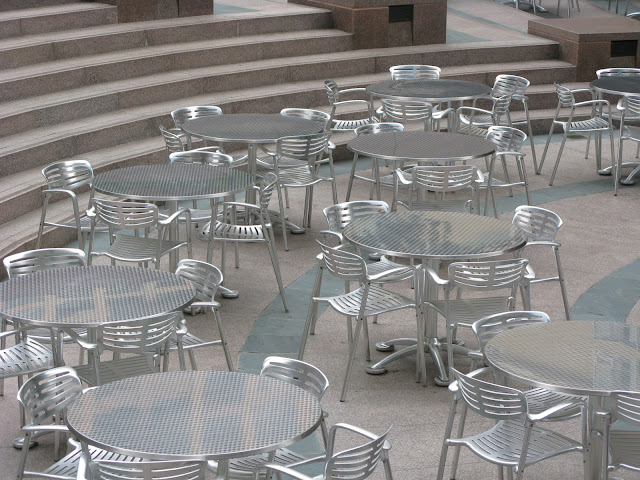
Find the location of `table 2 chairs`. table 2 chairs is located at coordinates (498, 316), (477, 400), (619, 411).